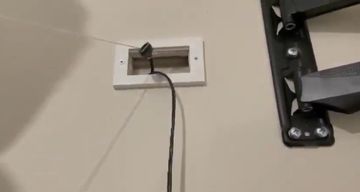
At what (x,y) coordinates should I click in order to perform the action: click on shelf. Please return your answer as a coordinate pair (x, y). This screenshot has width=360, height=192. Looking at the image, I should click on (333, 85), (299, 12).